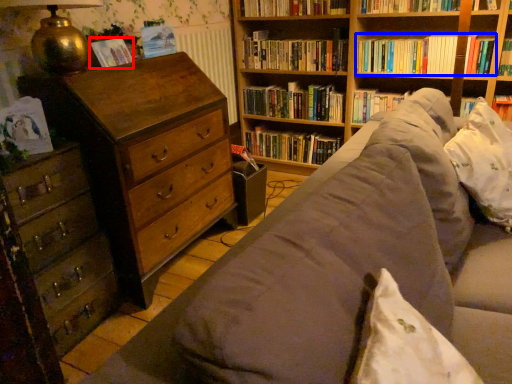
Question: Which object is further to the camera taking this photo, paperback book (highlighted by a red box) or book (highlighted by a blue box)?

Choices:
 (A) paperback book
 (B) book

Answer: (B)